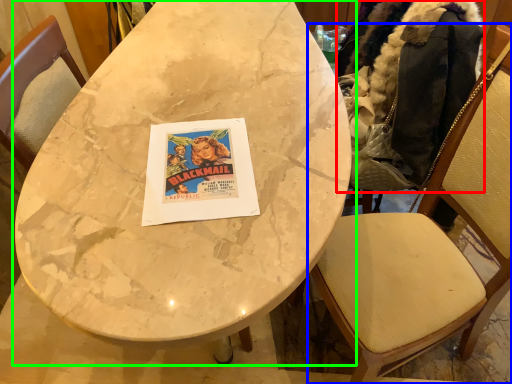
Question: Estimate the real-world distances between objects in this image. Which object is closer to jacket (highlighted by a red box), chair (highlighted by a blue box) or table (highlighted by a green box)?

Choices:
 (A) chair
 (B) table

Answer: (A)